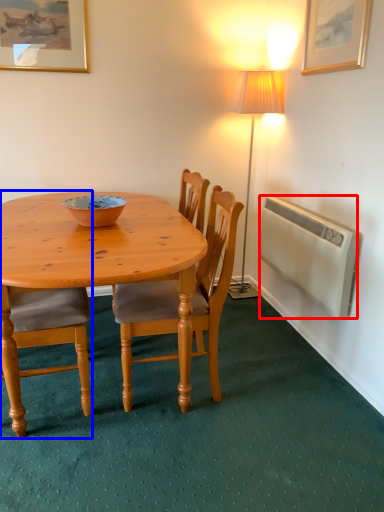
Question: Which object is further to the camera taking this photo, radiator (highlighted by a red box) or chair (highlighted by a blue box)?

Choices:
 (A) radiator
 (B) chair

Answer: (A)